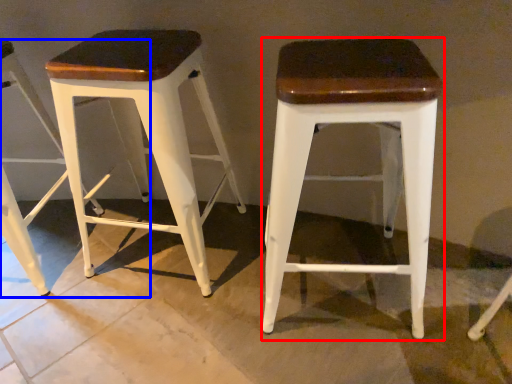
Question: Which point is further to the camera, stool (highlighted by a red box) or stool (highlighted by a blue box)?

Choices:
 (A) stool
 (B) stool

Answer: (B)